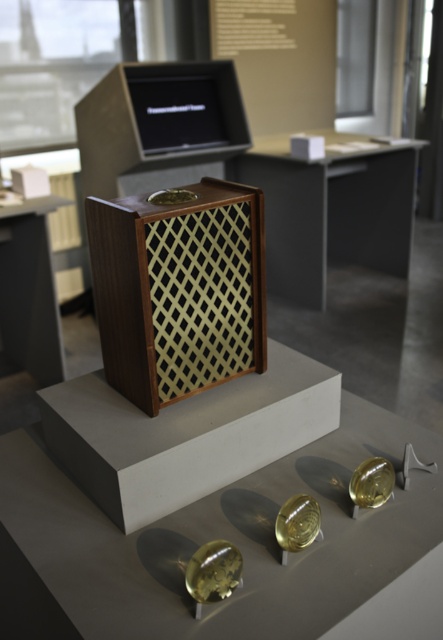
Question: Which point is closer to the camera taking this photo?

Choices:
 (A) (43, 234)
 (B) (349, 202)

Answer: (A)

Question: Which object appears closest to the camera in this image?

Choices:
 (A) matte black table at left
 (B) matte wood table at center

Answer: (A)

Question: Is matte wood table at center further to camera compared to matte black table at left?

Choices:
 (A) no
 (B) yes

Answer: (B)

Question: Is matte wood table at center bigger than matte black table at left?

Choices:
 (A) yes
 (B) no

Answer: (A)

Question: Can you confirm if matte wood table at center is positioned above matte black table at left?

Choices:
 (A) no
 (B) yes

Answer: (B)